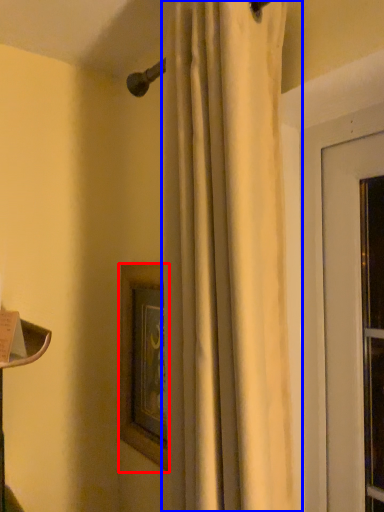
Question: Which object appears closest to the camera in this image, picture frame (highlighted by a red box) or curtain (highlighted by a blue box)?

Choices:
 (A) picture frame
 (B) curtain

Answer: (B)